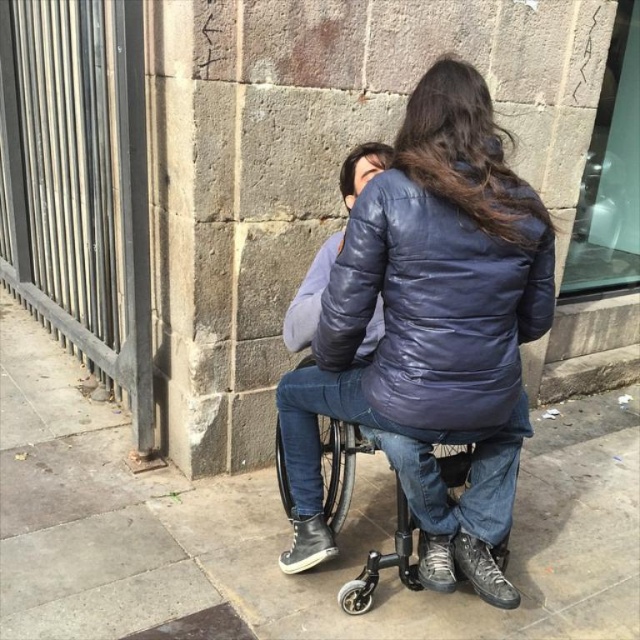
In the scene shown: You are a delivery person who needs to place a small package between the matte blue jacket at center and the black plastic wheelchair at center. Can you fit the package in the space between them if the package is 10 inches long?

The distance between the matte blue jacket at center and the black plastic wheelchair at center is 9.54 inches. Since the package is 10 inches long, it cannot fit in the space between them as the package is slightly longer than the available space.

You are standing in front of the sidewalk scene described. You need to place a 1.5 meter long banner on the concrete pavement at center. Will the banner fit without overlapping any objects?

The concrete pavement at center is 1.66 meters from viewer. Since the banner is 1.5 meters long, it will fit as it is shorter than the available space.

You need to place a large picnic basket on the ground between the concrete pavement at center and the black plastic wheelchair at center. Which area should you choose to ensure it fits comfortably?

The concrete pavement at center is bigger than the black plastic wheelchair at center, so placing the large picnic basket on the concrete pavement at center would provide enough space for it to fit comfortably.